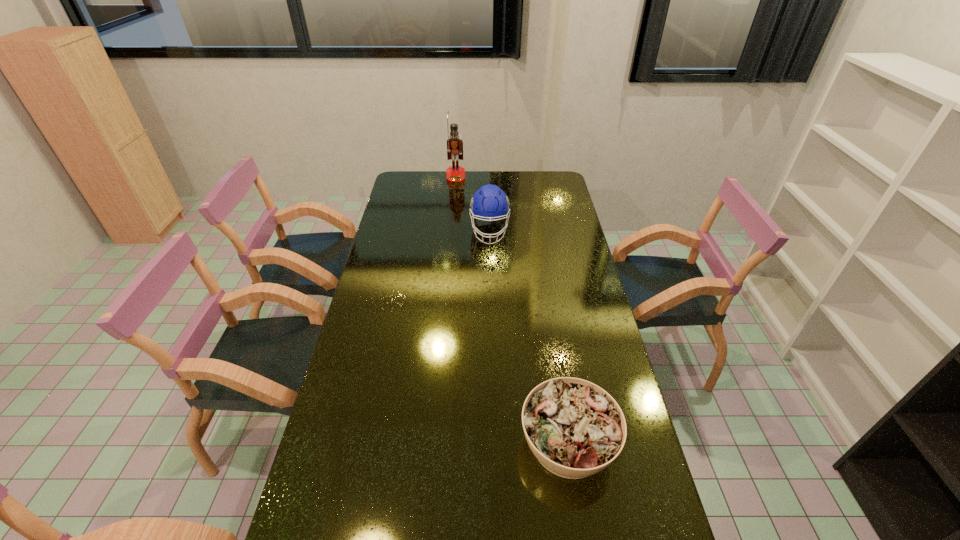
Where is `vacant area in the image that satisfies the following two spatial constraints: 1. on the front-facing side of the leftmost object; 2. on the right side of the salad`? Image resolution: width=960 pixels, height=540 pixels. vacant area in the image that satisfies the following two spatial constraints: 1. on the front-facing side of the leftmost object; 2. on the right side of the salad is located at coordinates (433, 442).

Locate an element on the screen. The width and height of the screenshot is (960, 540). free space in the image that satisfies the following two spatial constraints: 1. on the front-facing side of the football helmet; 2. on the left side of the shortest object is located at coordinates (495, 442).